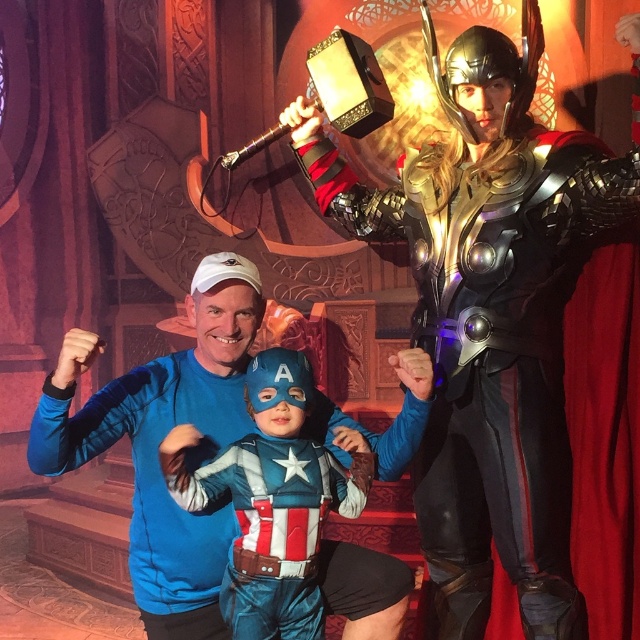
Question: Is shiny gold armor at center smaller than velvet blue costume at center?

Choices:
 (A) yes
 (B) no

Answer: (B)

Question: Estimate the real-world distances between objects in this image. Which object is farther from the blue fabric shirt at center?

Choices:
 (A) shiny gold armor at center
 (B) velvet blue costume at center

Answer: (A)

Question: Which point appears farthest from the camera in this image?

Choices:
 (A) (388, 236)
 (B) (266, 516)

Answer: (A)

Question: Estimate the real-world distances between objects in this image. Which object is closer to the blue fabric shirt at center?

Choices:
 (A) shiny gold armor at center
 (B) velvet blue costume at center

Answer: (B)

Question: Is shiny gold armor at center above blue fabric shirt at center?

Choices:
 (A) yes
 (B) no

Answer: (A)

Question: Is blue fabric shirt at center to the left of velvet blue costume at center from the viewer's perspective?

Choices:
 (A) no
 (B) yes

Answer: (B)